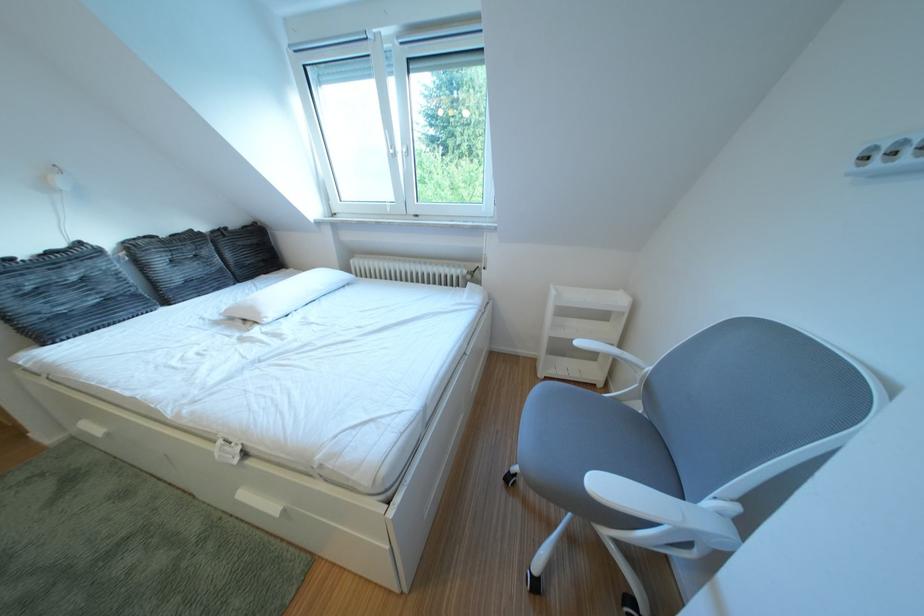
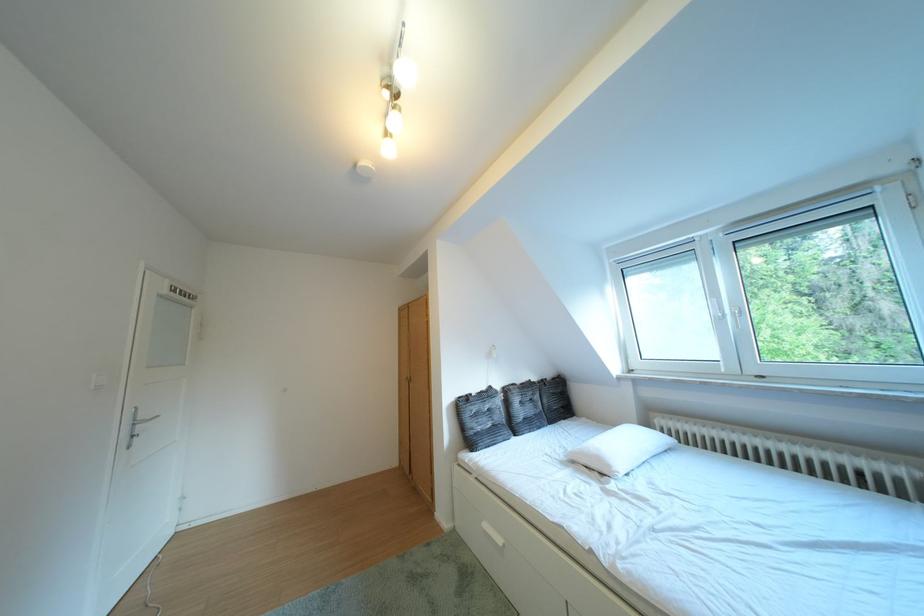
The point at (93,249) is marked in the first image. Where is the corresponding point in the second image?

(504, 392)